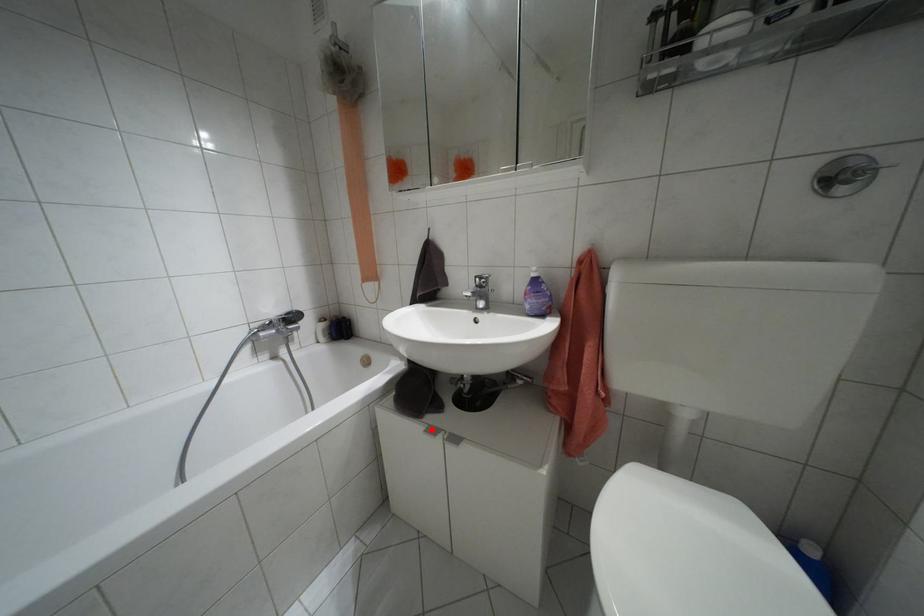
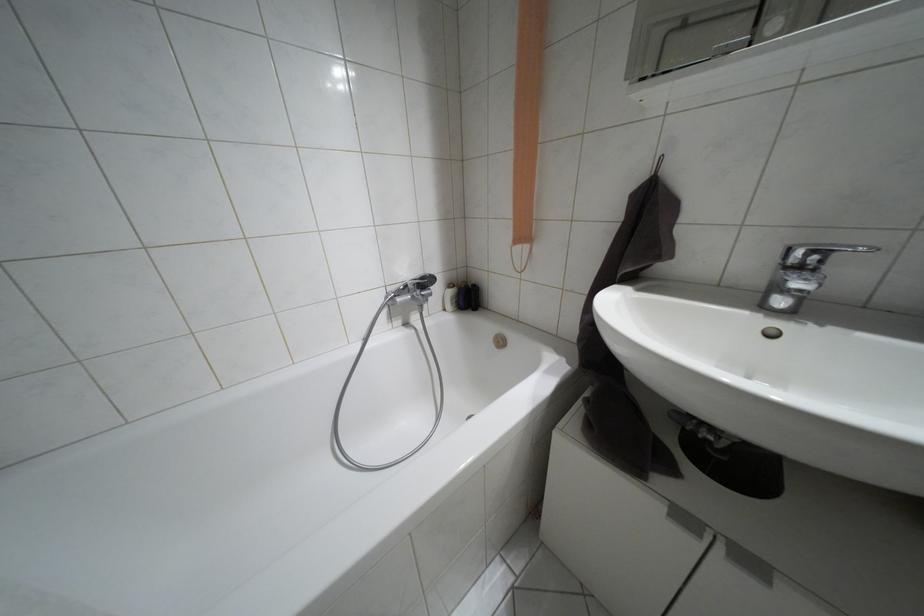
In the second image, find the point that corresponds to the highlighted location in the first image.

(684, 517)